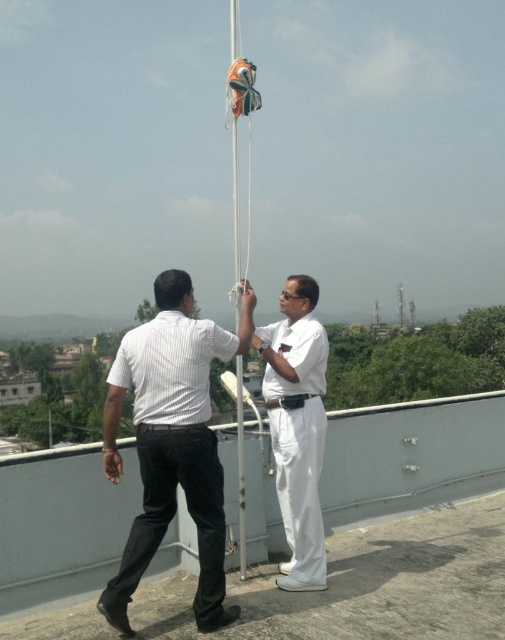
You are a safety inspector on the deck of a ship. You need to ensure that the white striped shirt at center and the white glossy sailor at center are positioned correctly according to safety protocols. According to the image, which individual is positioned to the left of the other?

The white striped shirt at center is positioned to the left of the white glossy sailor at center.

You are standing at the origin point of the coordinate system. Where is the white striped shirt at center located in terms of coordinates?

The white striped shirt at center is located at point (172, 442).